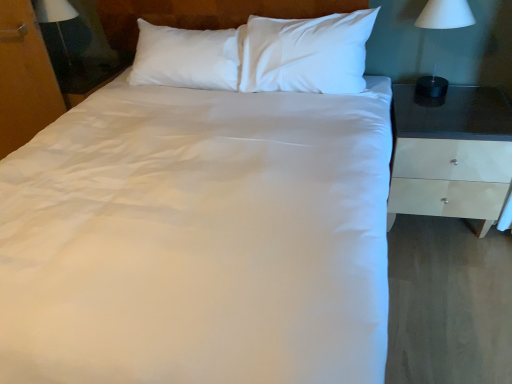
Question: Does white glossy nightstand at right appear on the left side of white matte lamp at right, the 2th bedside lamp from the back?

Choices:
 (A) no
 (B) yes

Answer: (A)

Question: Is white glossy nightstand at right not inside white matte lamp at right, the first bedside lamp from the right?

Choices:
 (A) no
 (B) yes

Answer: (B)

Question: Can you confirm if white glossy nightstand at right is taller than white matte lamp at right, which appears as the second bedside lamp when viewed from the left?

Choices:
 (A) yes
 (B) no

Answer: (A)

Question: Is white glossy nightstand at right closer to camera compared to white matte lamp at right, the first bedside lamp from the right?

Choices:
 (A) yes
 (B) no

Answer: (A)

Question: From a real-world perspective, is white glossy nightstand at right physically below white matte lamp at right, the 2th bedside lamp from the back?

Choices:
 (A) yes
 (B) no

Answer: (A)

Question: From a real-world perspective, is white glossy nightstand at right on white matte lamp at right, the 2th bedside lamp from the back?

Choices:
 (A) yes
 (B) no

Answer: (B)

Question: Can you confirm if wooden dresser at left is positioned to the left of matte black lampshade at left, which ranks as the 1th bedside lamp in left-to-right order?

Choices:
 (A) no
 (B) yes

Answer: (B)

Question: Is wooden dresser at left not close to matte black lampshade at left, the second bedside lamp from the front?

Choices:
 (A) no
 (B) yes

Answer: (A)

Question: Can you confirm if wooden dresser at left is bigger than matte black lampshade at left, the second bedside lamp from the front?

Choices:
 (A) no
 (B) yes

Answer: (B)

Question: Is wooden dresser at left to the right of matte black lampshade at left, which ranks as the 1th bedside lamp in left-to-right order, from the viewer's perspective?

Choices:
 (A) yes
 (B) no

Answer: (B)

Question: Could matte black lampshade at left, the second bedside lamp from the front, be considered to be inside wooden dresser at left?

Choices:
 (A) yes
 (B) no

Answer: (B)

Question: From the image's perspective, is wooden dresser at left on matte black lampshade at left, which ranks as the 1th bedside lamp in left-to-right order?

Choices:
 (A) yes
 (B) no

Answer: (B)

Question: Is white matte lamp at right, the 2th bedside lamp from the back, closer to the viewer compared to matte black lampshade at left, which ranks as the 1th bedside lamp in left-to-right order?

Choices:
 (A) yes
 (B) no

Answer: (A)